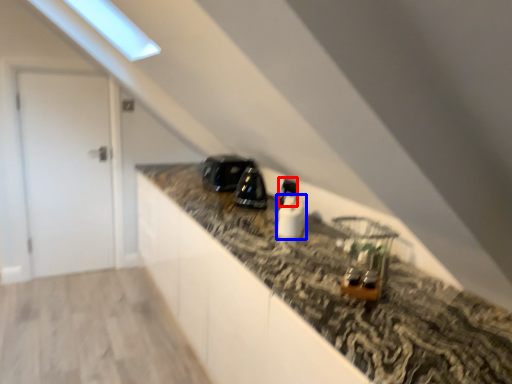
Question: Which of the following is the farthest to the observer, appliance (highlighted by a red box) or appliance (highlighted by a blue box)?

Choices:
 (A) appliance
 (B) appliance

Answer: (A)